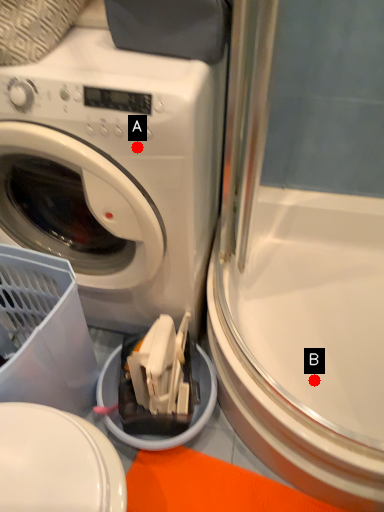
Question: Two points are circled on the image, labeled by A and B beside each circle. Which point appears farthest from the camera in this image?

Choices:
 (A) A is further
 (B) B is further

Answer: (B)